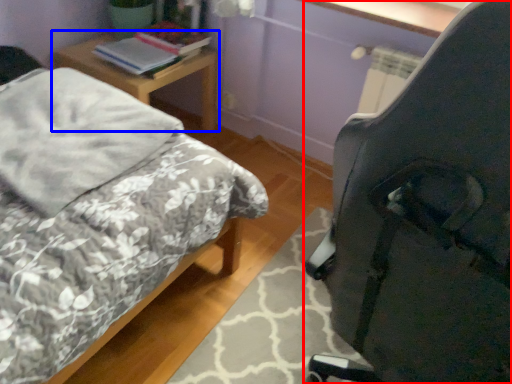
Question: Which of the following is the closest to the observer, chair (highlighted by a red box) or nightstand (highlighted by a blue box)?

Choices:
 (A) chair
 (B) nightstand

Answer: (A)